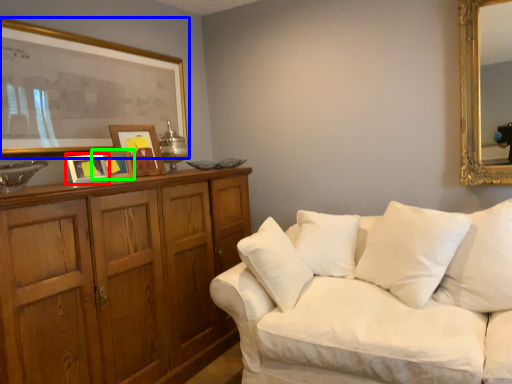
Question: Which object is the farthest from picture frame (highlighted by a red box)? Choose among these: picture frame (highlighted by a blue box) or picture frame (highlighted by a green box).

Choices:
 (A) picture frame
 (B) picture frame

Answer: (A)